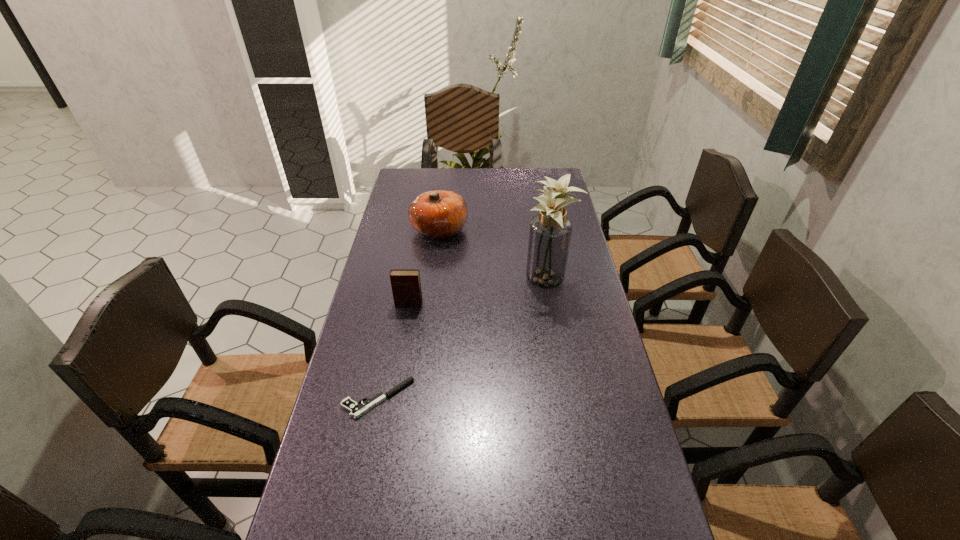
Select which object is the third closest to the second shortest object. Please provide its 2D coordinates. Your answer should be formatted as a tuple, i.e. [(x, y)], where the tuple contains the x and y coordinates of a point satisfying the conditions above.

[(550, 232)]

Locate an element on the screen. free space in the image that satisfies the following two spatial constraints: 1. on the front cover of the second shortest object; 2. on the front-facing side of the pistol is located at coordinates (393, 399).

The image size is (960, 540). Identify the location of free space in the image that satisfies the following two spatial constraints: 1. on the front side of the pumpkin; 2. on the left side of the rightmost object. (433, 281).